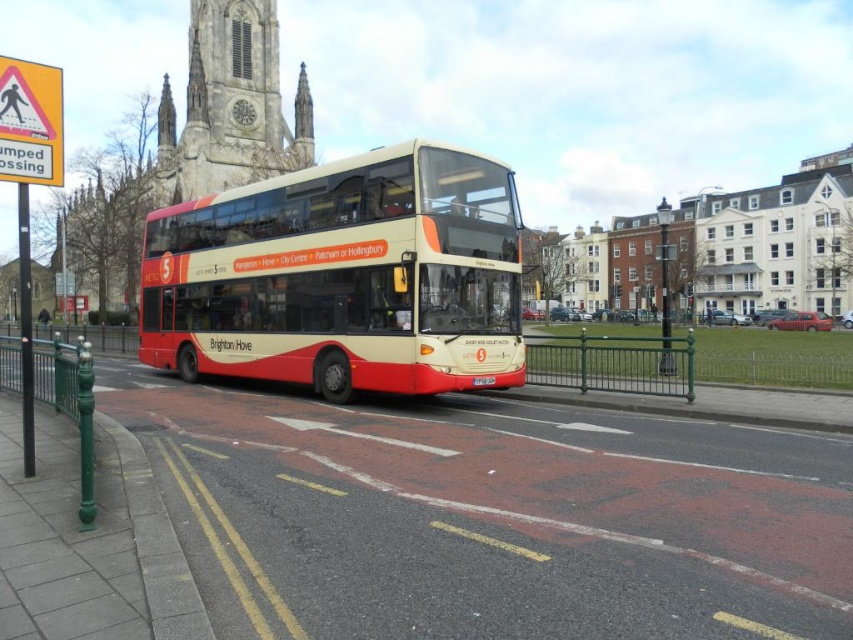
You are a pedestrian waiting at the yellow plastic pedestrian crossing sign at upper left and want to cross the road to reach the white plastic license plate at center. Is the license plate visible to you from your current position?

The yellow plastic pedestrian crossing sign at upper left is closer to the viewer than the white plastic license plate at center, so yes, the license plate is visible from the pedestrian crossing sign.